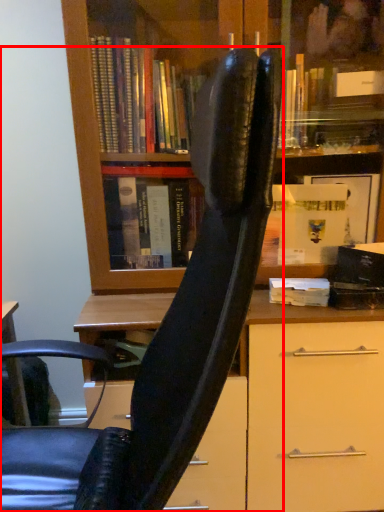
Question: Observing the image, what is the correct spatial positioning of chair (annotated by the red box) in reference to book?

Choices:
 (A) right
 (B) left

Answer: (B)